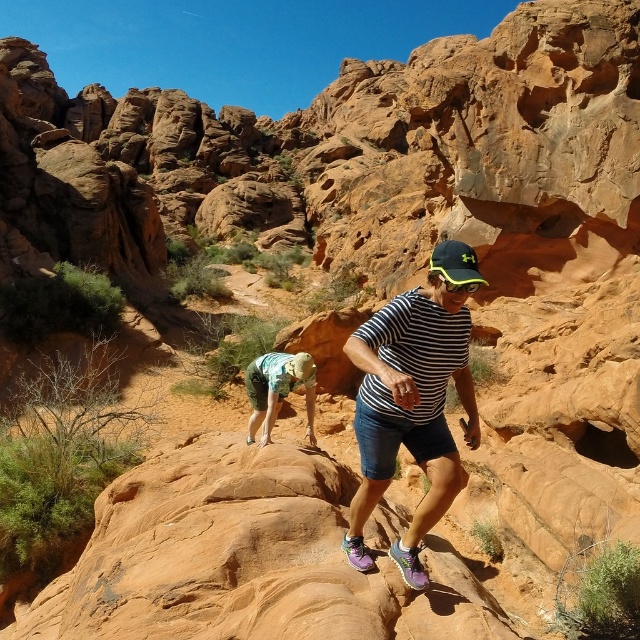
Which is above, striped cotton shirt at center or green camouflage shorts at center?

Positioned higher is striped cotton shirt at center.

Between striped cotton shirt at center and green camouflage shorts at center, which one appears on the left side from the viewer's perspective?

green camouflage shorts at center

Between point (435, 272) and point (312, 362), which one is positioned behind?

Point (312, 362)

Locate an element on the screen. This screenshot has width=640, height=640. striped cotton shirt at center is located at coordinates (413, 400).

Between striped cotton shirt at center and black matte baseball cap at center, which one appears on the right side from the viewer's perspective?

Positioned to the right is black matte baseball cap at center.

Is striped cotton shirt at center bigger than black matte baseball cap at center?

Indeed, striped cotton shirt at center has a larger size compared to black matte baseball cap at center.

You are a GUI agent. You are given a task and a screenshot of the screen. Output one action in this format:
    pyautogui.click(x=<x>, y=<y>)
    Task: Click on the striped cotton shirt at center
    This screenshot has height=640, width=640.
    Given the screenshot: What is the action you would take?
    pyautogui.click(x=413, y=400)

At what (x,y) coordinates should I click in order to perform the action: click on striped cotton shirt at center. Please return your answer as a coordinate pair (x, y). The height and width of the screenshot is (640, 640). Looking at the image, I should click on click(413, 400).

Is green camouflage shorts at center bigger than black matte baseball cap at center?

No, green camouflage shorts at center is not bigger than black matte baseball cap at center.

Is green camouflage shorts at center thinner than black matte baseball cap at center?

Yes, green camouflage shorts at center is thinner than black matte baseball cap at center.

Does point (273, 417) lie in front of point (465, 256)?

No, it is not.

The width and height of the screenshot is (640, 640). In order to click on green camouflage shorts at center in this screenshot , I will do `click(276, 390)`.